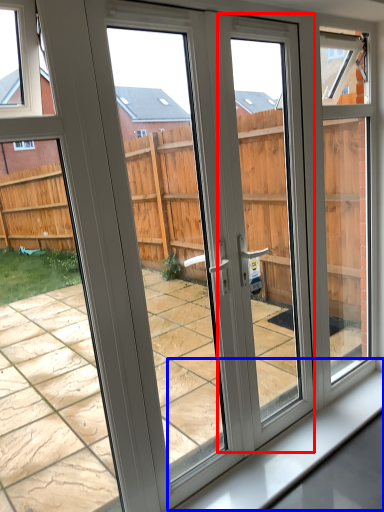
Question: Which object is closer to the camera taking this photo, screen door (highlighted by a red box) or window sill (highlighted by a blue box)?

Choices:
 (A) screen door
 (B) window sill

Answer: (A)